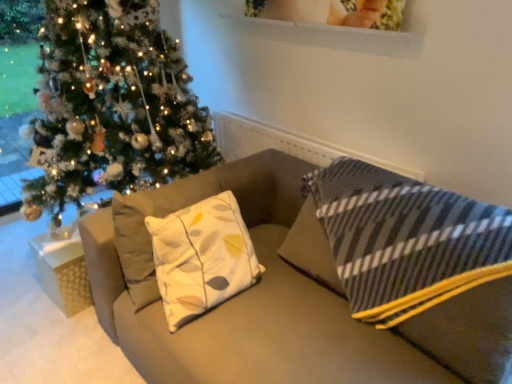
Question: Looking at their shapes, would you say shiny green christmas tree at left is wider or thinner than matte beige couch at center?

Choices:
 (A) thin
 (B) wide

Answer: (B)

Question: Considering the positions of point (99, 62) and point (267, 296), is point (99, 62) closer or farther from the camera than point (267, 296)?

Choices:
 (A) closer
 (B) farther

Answer: (B)

Question: Which is nearer to the white textured gift box at lower left?

Choices:
 (A) shiny green christmas tree at left
 (B) matte beige couch at center

Answer: (A)

Question: Which object is the farthest from the white textured gift box at lower left?

Choices:
 (A) shiny green christmas tree at left
 (B) matte beige couch at center

Answer: (B)